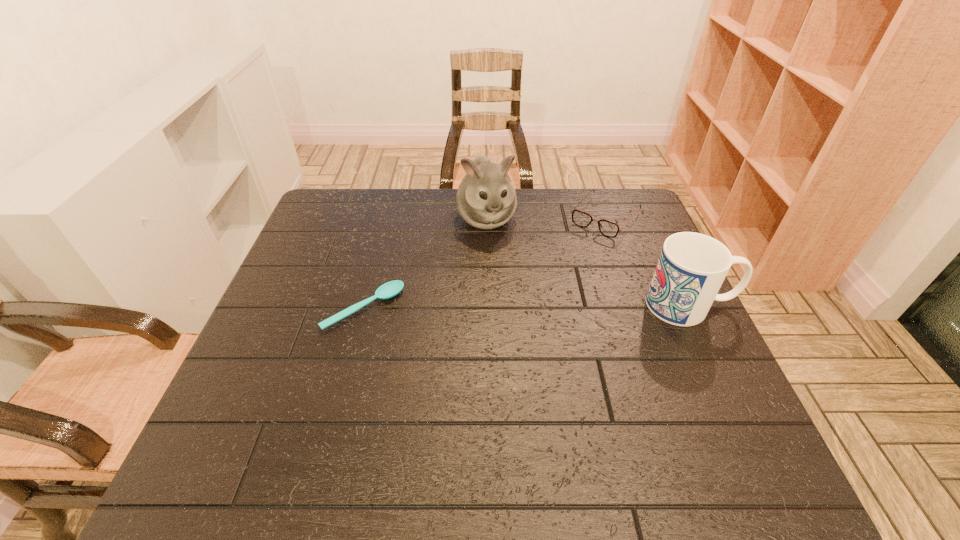
Locate an element on the screen. free location located on the front-facing side of the sunglasses is located at coordinates (536, 300).

I want to click on vacant region located 0.330m on the face of the third object from right to left, so click(x=523, y=328).

Locate an element on the screen. The image size is (960, 540). free space located 0.130m on the face of the third object from right to left is located at coordinates (504, 272).

Find the location of a particular element. Image resolution: width=960 pixels, height=540 pixels. vacant space located on the face of the third object from right to left is located at coordinates (528, 341).

Find the location of a particular element. This screenshot has height=540, width=960. sunglasses that is at the far edge is located at coordinates (607, 228).

This screenshot has width=960, height=540. In order to click on hamster situated at the far edge in this screenshot , I will do `click(486, 199)`.

At what (x,y) coordinates should I click in order to perform the action: click on object at the left edge. Please return your answer as a coordinate pair (x, y). Looking at the image, I should click on (390, 289).

The width and height of the screenshot is (960, 540). I want to click on mug that is at the right edge, so click(691, 268).

Find the location of a particular element. This screenshot has width=960, height=540. sunglasses at the right edge is located at coordinates (607, 228).

I want to click on object at the far right corner, so click(607, 228).